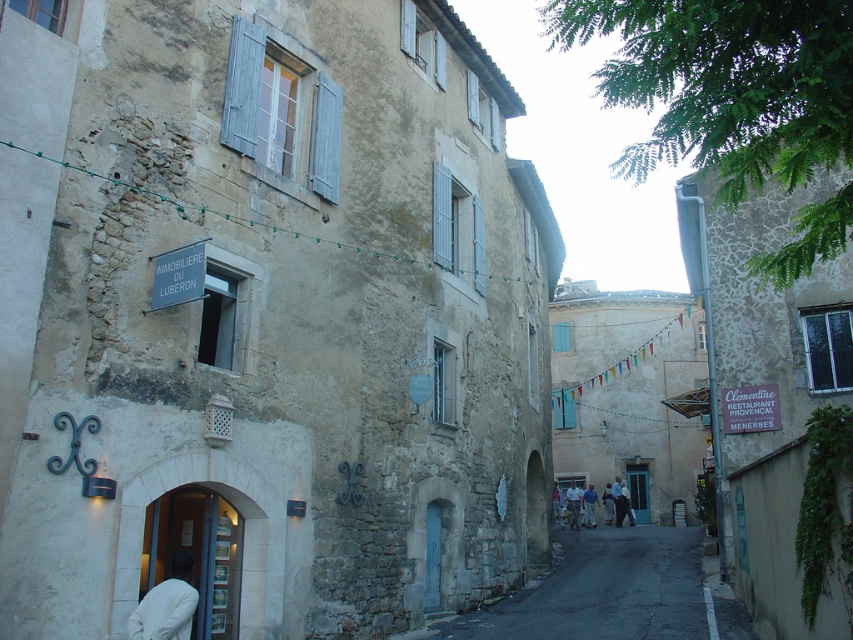
The width and height of the screenshot is (853, 640). What are the coordinates of `white cloth at lower left` in the screenshot? It's located at (167, 604).

Looking at this image, is white cloth at lower left closer to the viewer compared to stone signboard at upper center?

That is True.

What do you see at coordinates (167, 604) in the screenshot? This screenshot has height=640, width=853. I see `white cloth at lower left` at bounding box center [167, 604].

At what (x,y) coordinates should I click in order to perform the action: click on white cloth at lower left. Please return your answer as a coordinate pair (x, y). This screenshot has width=853, height=640. Looking at the image, I should click on (167, 604).

Measure the distance between stone signboard at upper center and camera.

The distance of stone signboard at upper center from camera is 26.83 meters.

Looking at this image, is stone signboard at upper center closer to camera compared to light blue shirt at center?

Yes, stone signboard at upper center is in front of light blue shirt at center.

Does point (236, 218) come farther from viewer compared to point (577, 525)?

No.

Where is `stone signboard at upper center`? stone signboard at upper center is located at coordinates (115, 180).

Identify the location of dark asphalt road at center. (602, 589).

Is dark asphalt road at center to the left of light blue shirt at center from the viewer's perspective?

Correct, you'll find dark asphalt road at center to the left of light blue shirt at center.

Does point (561, 612) come closer to viewer compared to point (572, 500)?

Yes, it is in front of point (572, 500).

The image size is (853, 640). What are the coordinates of `dark asphalt road at center` in the screenshot? It's located at (602, 589).